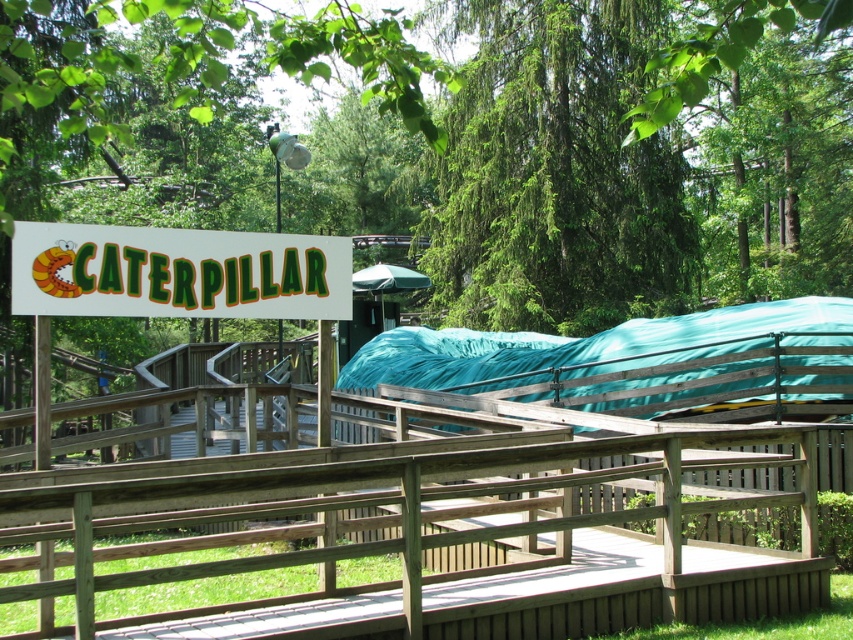
You are standing in front of the wooden structure with the caterpillar sign. There are two points marked in the image. Which point is closer to you, point (96, 624) or point (413, 275)?

Point (96, 624) is closer to the viewer than point (413, 275).

Based on the photo, you are a parent holding a child who wants to play on the wooden rail at center and the green fabric canopy at center. The child is 1.2 meters tall. Can the child safely reach both objects without needing to stretch too much?

The wooden rail at center and green fabric canopy at center are 16.36 meters apart. Since the child is only 1.2 meters tall, they would need to walk a significant distance between the two objects, which might be challenging for them to do safely without assistance.

You are a park visitor holding a 1.20 meter wide kite. You want to fly it between the white plastic sign at upper left and the green fabric canopy at center. Can the kite fit through the space between them?

The white plastic sign at upper left and green fabric canopy at center are 15.80 meters apart. Since the kite is only 1.20 meters wide, it can easily fit through the space between them.